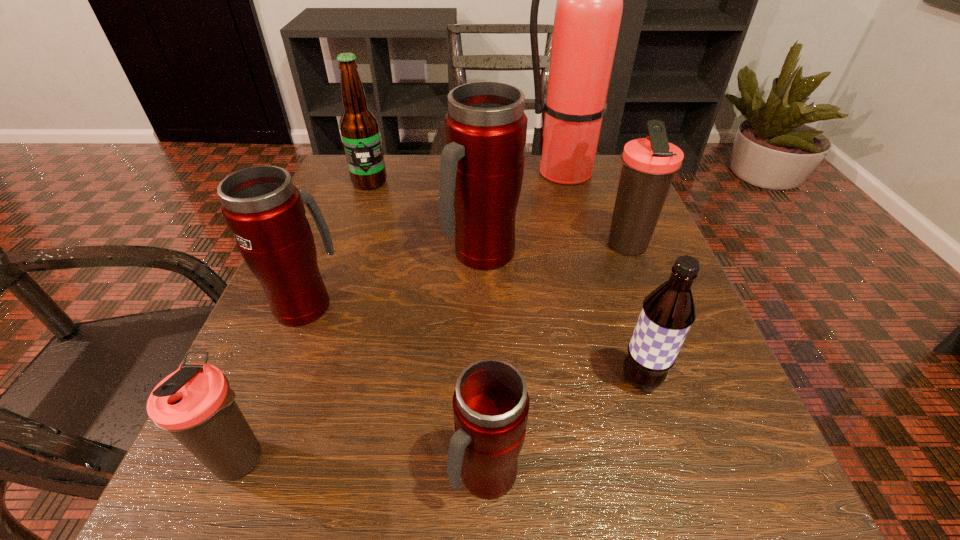
Where is `object that is at the far left corner`? The image size is (960, 540). object that is at the far left corner is located at coordinates (359, 127).

The height and width of the screenshot is (540, 960). What are the coordinates of `object situated at the near left corner` in the screenshot? It's located at (195, 403).

The image size is (960, 540). What are the coordinates of `object present at the far right corner` in the screenshot? It's located at (588, 13).

You are a GUI agent. You are given a task and a screenshot of the screen. Output one action in this format:
    pyautogui.click(x=<x>, y=<y>)
    Task: Click on the vacant region at the far edge
    Image resolution: width=960 pixels, height=540 pixels.
    Given the screenshot: What is the action you would take?
    pyautogui.click(x=416, y=165)

Locate an element on the screen. vacant region at the near edge is located at coordinates (334, 476).

Image resolution: width=960 pixels, height=540 pixels. I want to click on free region at the left edge of the desktop, so click(x=268, y=401).

This screenshot has width=960, height=540. I want to click on vacant region at the right edge of the desktop, so click(610, 313).

This screenshot has height=540, width=960. In the image, there is a desktop. What are the coordinates of `free region at the far left corner` in the screenshot? It's located at (393, 168).

What are the coordinates of `blank area at the near right corner` in the screenshot? It's located at (706, 458).

The height and width of the screenshot is (540, 960). In order to click on vacant region between the tallest thermos bottle and the second farthest red thermos bottle in this screenshot , I will do `click(394, 279)`.